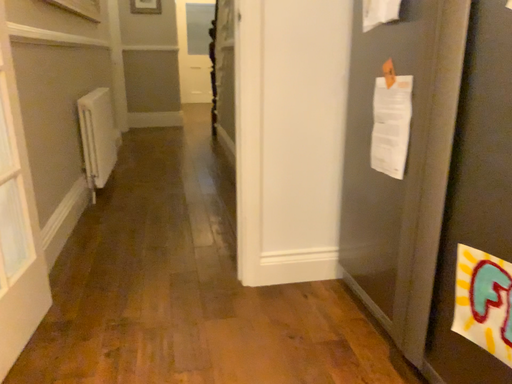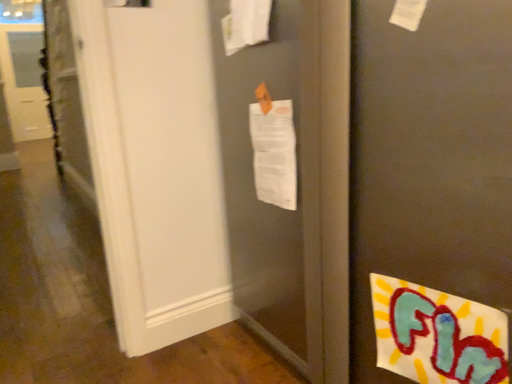
Question: How did the camera likely rotate when shooting the video?

Choices:
 (A) rotated right
 (B) rotated left

Answer: (A)